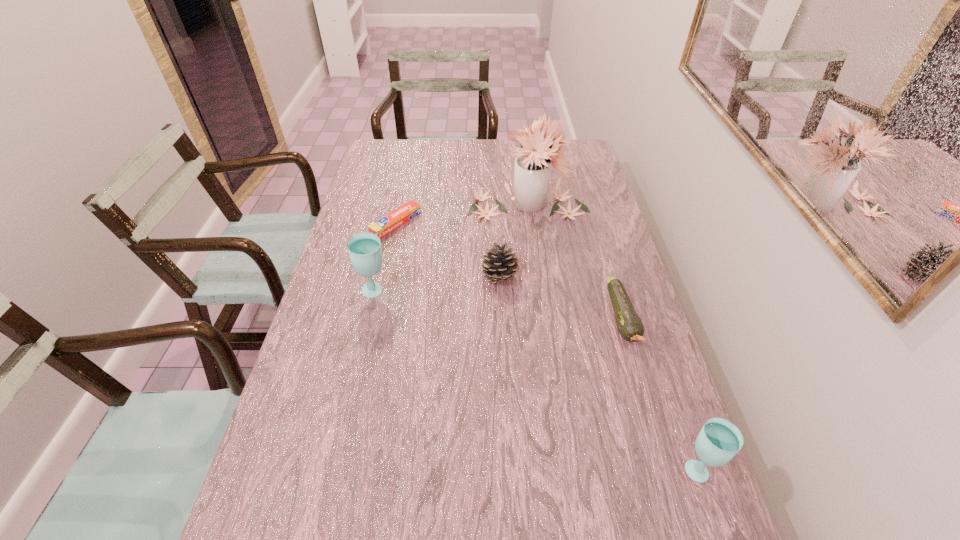
To make them evenly spaced by inserting another glass_(drink_container) among them, please locate a free space for this new glass_(drink_container). Please provide its 2D coordinates. Your answer should be formatted as a tuple, i.e. [(x, y)], where the tuple contains the x and y coordinates of a point satisfying the conditions above.

[(510, 366)]